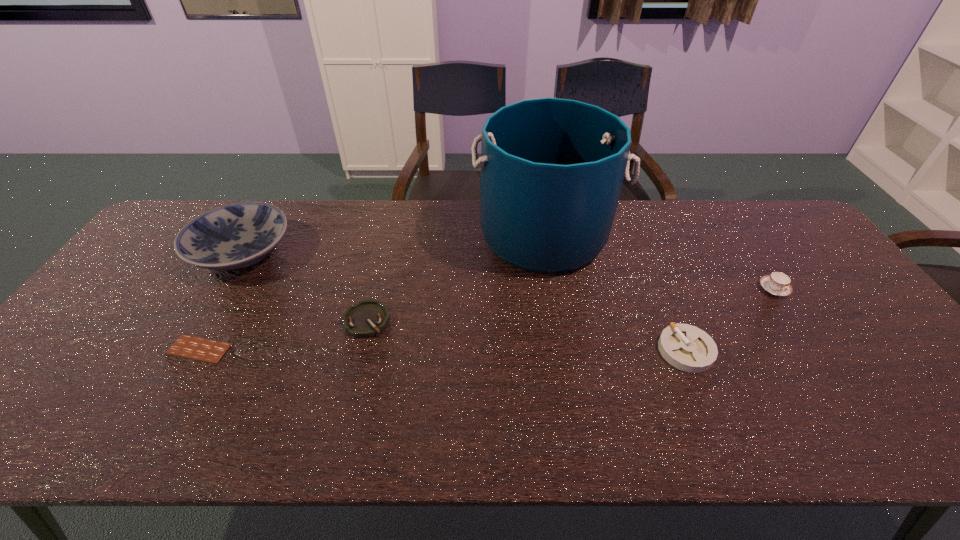
Where is `vacant region at the far edge of the desktop`? vacant region at the far edge of the desktop is located at coordinates (279, 204).

This screenshot has height=540, width=960. I want to click on vacant space at the near edge, so (380, 427).

Find the location of `vacant space at the left edge`. vacant space at the left edge is located at coordinates (100, 315).

Image resolution: width=960 pixels, height=540 pixels. In the image, there is a desktop. Find the location of `vacant space at the right edge`. vacant space at the right edge is located at coordinates (772, 259).

Image resolution: width=960 pixels, height=540 pixels. What are the coordinates of `vacant space at the far right corner` in the screenshot? It's located at tap(738, 203).

At what (x,y) coordinates should I click in order to perform the action: click on free space between the third tallest object and the fifth object from left to right. Please return your answer as a coordinate pair (x, y). The image size is (960, 540). Looking at the image, I should click on (730, 320).

In order to click on vacant area that lies between the left ashtray and the third tallest object in this screenshot , I will do `click(570, 305)`.

You are a GUI agent. You are given a task and a screenshot of the screen. Output one action in this format:
    pyautogui.click(x=<x>, y=<y>)
    Task: Click on the empty location between the shortest object and the fourth object from right to left
    
    Given the screenshot: What is the action you would take?
    pyautogui.click(x=283, y=335)

At what (x,y) coordinates should I click in order to perform the action: click on free space between the fourth shortest object and the shorter ashtray. Please return your answer as a coordinate pair (x, y). Looking at the image, I should click on (570, 305).

You are a GUI agent. You are given a task and a screenshot of the screen. Output one action in this format:
    pyautogui.click(x=<x>, y=<y>)
    Task: Click on the free space that is in between the left ashtray and the second tallest object
    The image size is (960, 540).
    Given the screenshot: What is the action you would take?
    pyautogui.click(x=304, y=286)